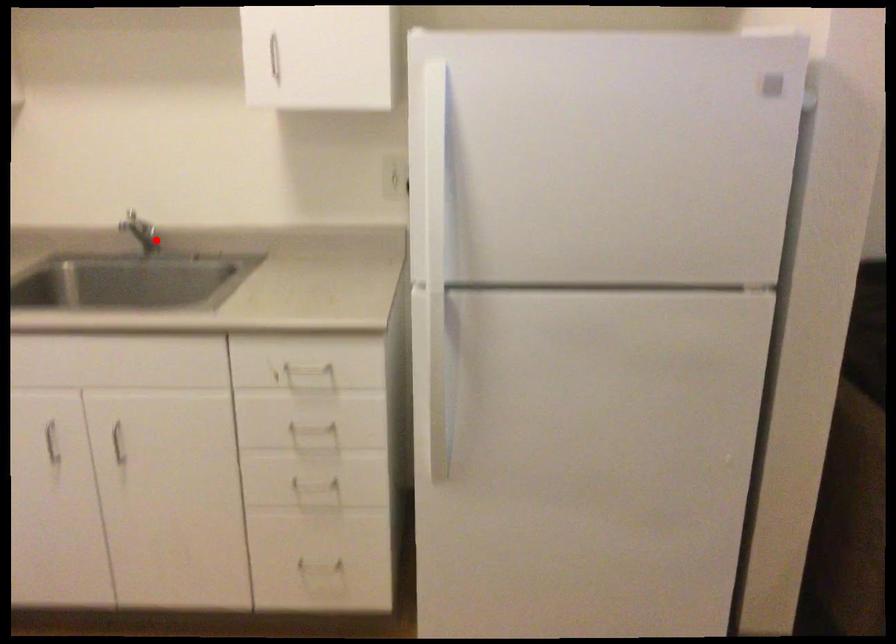
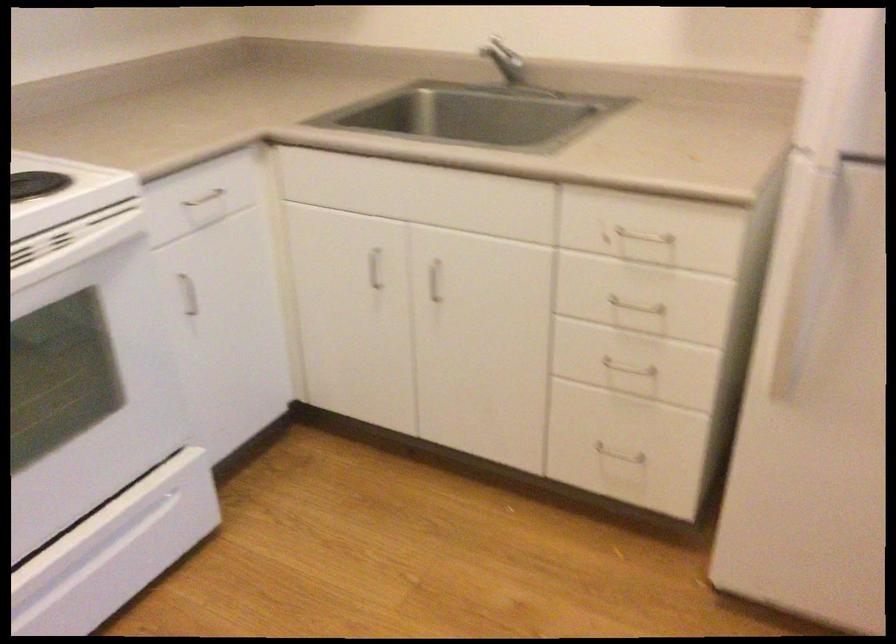
Question: I am providing you with two images of the same scene from different viewpoints. Image1 has a red point marked. In image2, the corresponding 3D location appears at what relative position? Reply with the corresponding letter.

Choices:
 (A) Closer
 (B) Farther

Answer: (A)